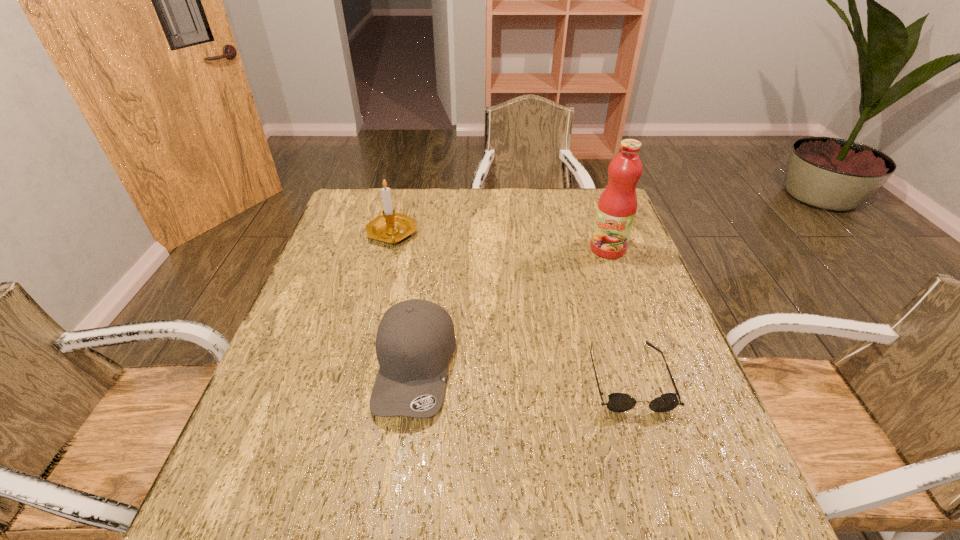
I want to click on free location located 0.390m with a handle on the third shortest object, so click(x=484, y=329).

You are a GUI agent. You are given a task and a screenshot of the screen. Output one action in this format:
    pyautogui.click(x=<x>, y=<y>)
    Task: Click on the free space located with a handle on the third shortest object
    The width and height of the screenshot is (960, 540).
    Given the screenshot: What is the action you would take?
    pyautogui.click(x=482, y=326)

This screenshot has width=960, height=540. I want to click on object located at the far edge, so click(x=391, y=227).

You are a GUI agent. You are given a task and a screenshot of the screen. Output one action in this format:
    pyautogui.click(x=<x>, y=<y>)
    Task: Click on the object that is at the left edge
    
    Given the screenshot: What is the action you would take?
    pyautogui.click(x=391, y=227)

The height and width of the screenshot is (540, 960). I want to click on sunglasses that is at the right edge, so click(x=618, y=402).

Image resolution: width=960 pixels, height=540 pixels. In order to click on fruit juice located in the right edge section of the desktop in this screenshot , I will do `click(617, 205)`.

This screenshot has height=540, width=960. I want to click on object that is positioned at the far left corner, so click(391, 227).

Find the location of a particular element. Image resolution: width=960 pixels, height=540 pixels. free space at the far edge of the desktop is located at coordinates pyautogui.click(x=473, y=222).

You are a GUI agent. You are given a task and a screenshot of the screen. Output one action in this format:
    pyautogui.click(x=<x>, y=<y>)
    Task: Click on the free region at the left edge
    The height and width of the screenshot is (540, 960).
    Given the screenshot: What is the action you would take?
    pyautogui.click(x=378, y=240)

You are a GUI agent. You are given a task and a screenshot of the screen. Output one action in this format:
    pyautogui.click(x=<x>, y=<y>)
    Task: Click on the vacant space at the right edge of the desktop
    
    Given the screenshot: What is the action you would take?
    pyautogui.click(x=660, y=304)